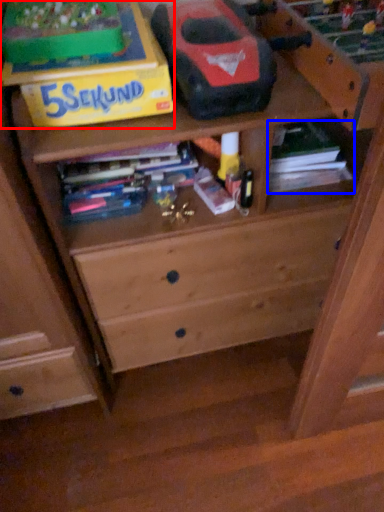
Question: Which point is further to the camera, cardboard box (highlighted by a red box) or book (highlighted by a blue box)?

Choices:
 (A) cardboard box
 (B) book

Answer: (B)